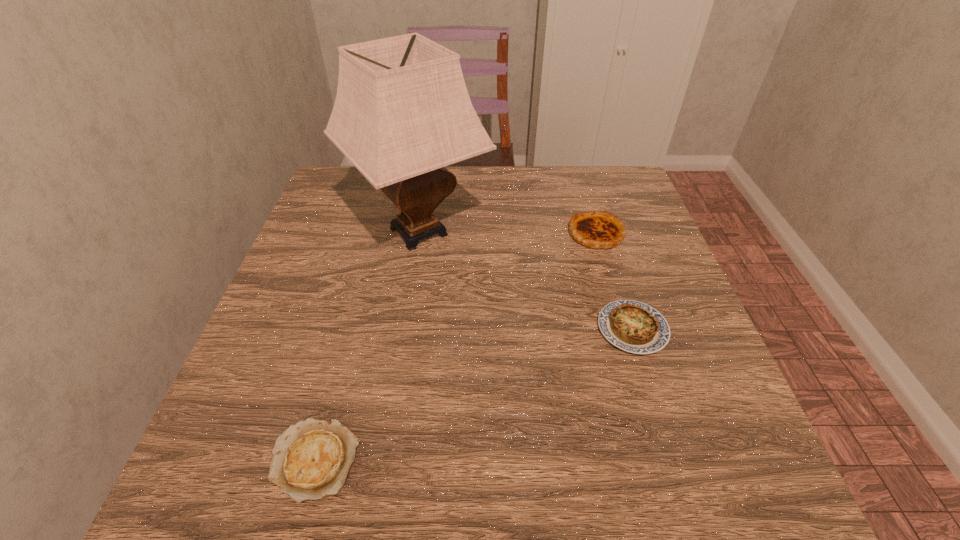
The width and height of the screenshot is (960, 540). I want to click on vacant space situated 0.390m on the back of the shortest object, so click(x=369, y=261).

This screenshot has height=540, width=960. I want to click on object present at the far edge, so pyautogui.click(x=402, y=113).

I want to click on object at the near edge, so click(311, 460).

Identify the location of lampshade present at the left edge. The height and width of the screenshot is (540, 960). tap(402, 113).

This screenshot has width=960, height=540. What are the coordinates of `quiche that is positioned at the left edge` in the screenshot? It's located at [x=311, y=460].

What are the coordinates of `object that is at the far left corner` in the screenshot? It's located at (402, 113).

This screenshot has height=540, width=960. In order to click on object that is at the near left corner in this screenshot , I will do `click(311, 460)`.

The width and height of the screenshot is (960, 540). In the image, there is a desktop. Find the location of `vacant space at the far edge`. vacant space at the far edge is located at coordinates (532, 192).

Where is `vacant space at the left edge`? vacant space at the left edge is located at coordinates (311, 310).

Find the location of a particular element. vacant space at the right edge of the desktop is located at coordinates (612, 299).